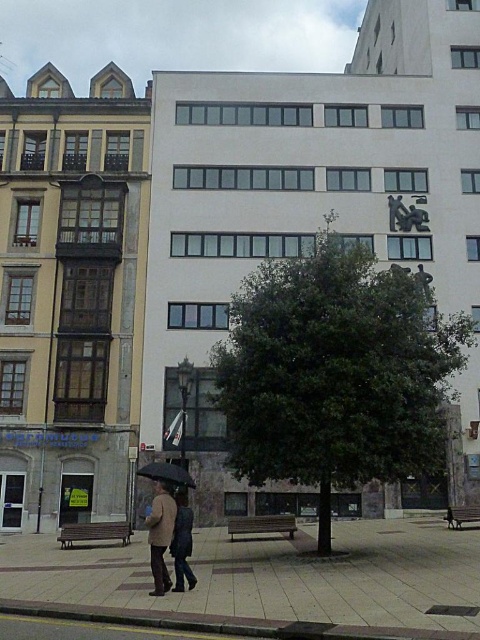
Can you confirm if smooth concrete pavement at lower center is taller than black matte umbrella at lower center?

Yes.

How distant is smooth concrete pavement at lower center from black matte umbrella at lower center?

A distance of 15.73 feet exists between smooth concrete pavement at lower center and black matte umbrella at lower center.

Where is `smooth concrete pavement at lower center`? The height and width of the screenshot is (640, 480). smooth concrete pavement at lower center is located at coordinates (273, 577).

Between dark blue jeans at center and black matte umbrella at lower center, which one appears on the left side from the viewer's perspective?

black matte umbrella at lower center is more to the left.

You are a GUI agent. You are given a task and a screenshot of the screen. Output one action in this format:
    pyautogui.click(x=<x>, y=<y>)
    Task: Click on the dark blue jeans at center
    This screenshot has height=640, width=480.
    Given the screenshot: What is the action you would take?
    pyautogui.click(x=181, y=541)

Is green leafy tree at center above smooth concrete pavement at lower center?

Indeed, green leafy tree at center is positioned over smooth concrete pavement at lower center.

How far apart are green leafy tree at center and smooth concrete pavement at lower center?

green leafy tree at center and smooth concrete pavement at lower center are 4.69 meters apart.

Does point (296, 300) come in front of point (372, 592)?

No.

Where is `green leafy tree at center`? The height and width of the screenshot is (640, 480). green leafy tree at center is located at coordinates (336, 372).